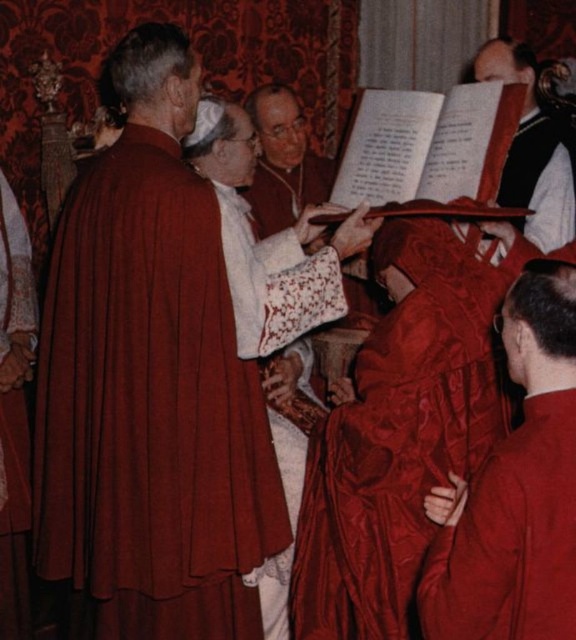
You are standing in the room and need to locate the matte red robe at left. According to the coordinates provided, where exactly is it positioned?

The matte red robe at left is located at point coordinates of 0.639 along the horizontal axis and 0.260 along the vertical axis.

You are standing in the room and want to locate the matte red robe at left. According to the coordinates provided, where should you look?

You should look at point 0.639 on the x axis and 0.260 on the y axis to find the matte red robe at left.